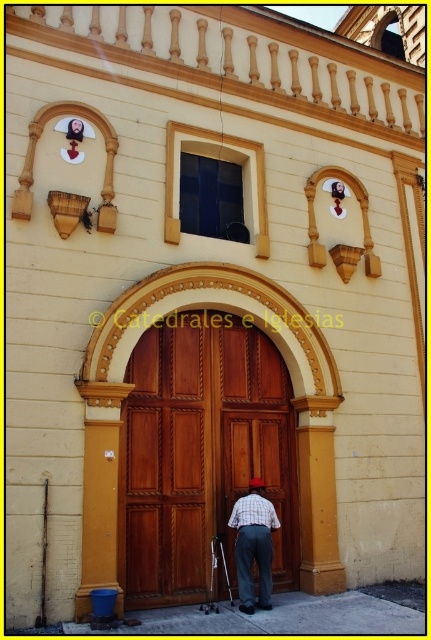
Who is more distant from viewer, (266, 388) or (240, 429)?

The point (266, 388) is behind.

Which is above, wooden door at center or wooden at center?

wooden at center is above.

Identify the location of wooden door at center. This screenshot has width=431, height=640. (202, 452).

Can you confirm if wooden at center is shorter than plaid fabric pants at center?

Indeed, wooden at center has a lesser height compared to plaid fabric pants at center.

Between point (275, 422) and point (241, 548), which one is positioned in front?

Point (241, 548) is more forward.

Locate an element on the screen. This screenshot has width=431, height=640. wooden at center is located at coordinates (256, 438).

Can you confirm if wooden door at center is bigger than plaid fabric pants at center?

Actually, wooden door at center might be smaller than plaid fabric pants at center.

Can you confirm if wooden door at center is taller than plaid fabric pants at center?

No, wooden door at center is not taller than plaid fabric pants at center.

Which is behind, point (271, 461) or point (252, 547)?

The point (271, 461) is behind.

This screenshot has width=431, height=640. In order to click on wooden door at center in this screenshot , I will do `click(202, 452)`.